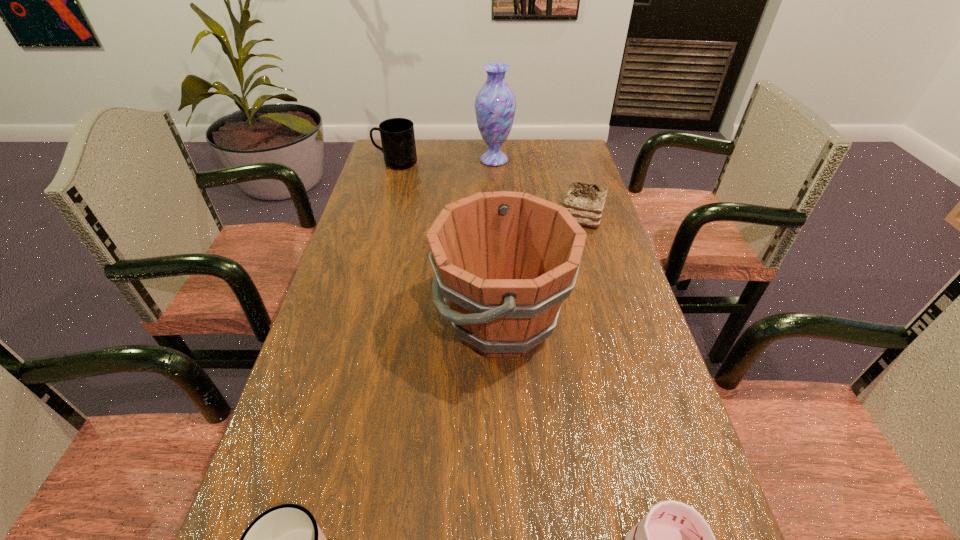
Find the location of a particular element. free point located 0.280m on the left of the chocolate cake is located at coordinates coord(466,217).

Locate an element on the screen. vase that is at the far edge is located at coordinates (495, 104).

Where is `mug at the far edge`? Image resolution: width=960 pixels, height=540 pixels. mug at the far edge is located at coordinates click(x=397, y=135).

Locate an element on the screen. object present at the left edge is located at coordinates (397, 135).

This screenshot has height=540, width=960. Find the location of `object positioned at the right edge`. object positioned at the right edge is located at coordinates (585, 202).

I want to click on object situated at the far left corner, so click(x=397, y=135).

Locate an element on the screen. This screenshot has width=960, height=540. vacant region at the far edge is located at coordinates (428, 151).

In the image, there is a desktop. Identify the location of vacant region at the left edge. The image size is (960, 540). (334, 356).

I want to click on vacant region at the right edge of the desktop, so click(x=656, y=384).

Where is `vacant space at the far right corner`? Image resolution: width=960 pixels, height=540 pixels. vacant space at the far right corner is located at coordinates (575, 168).